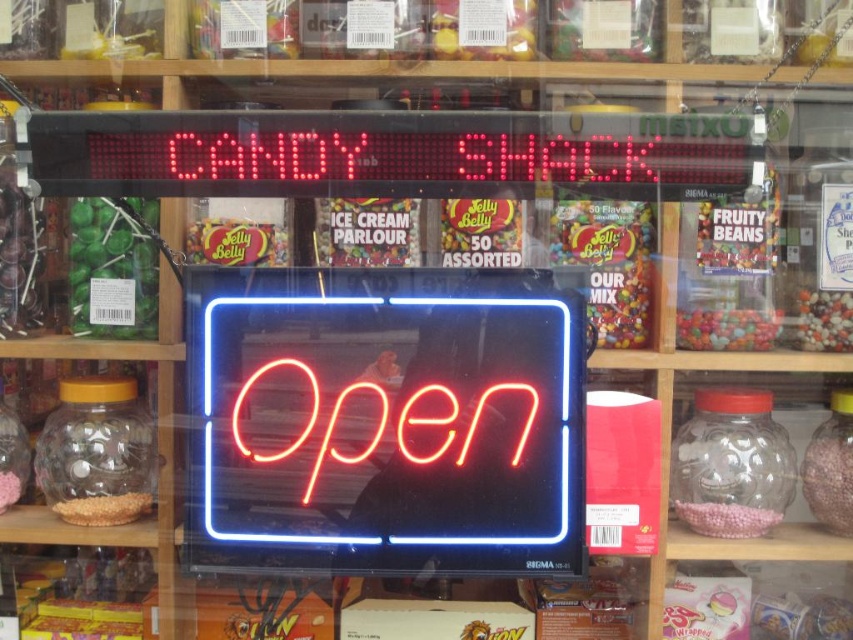
You are a customer looking at the candy shop window. You see the pink matte candy jar at right and the crumbly brown at lower left. Which object appears larger in the display?

The pink matte candy jar at right is bigger than the crumbly brown at lower left, so it appears larger in the display.

You are a customer entering the Candy Shack and see the pink matte candy jar at right and the crumbly brown at lower left. Which object is positioned to the right of the other?

The pink matte candy jar at right is to the right of crumbly brown at lower left.